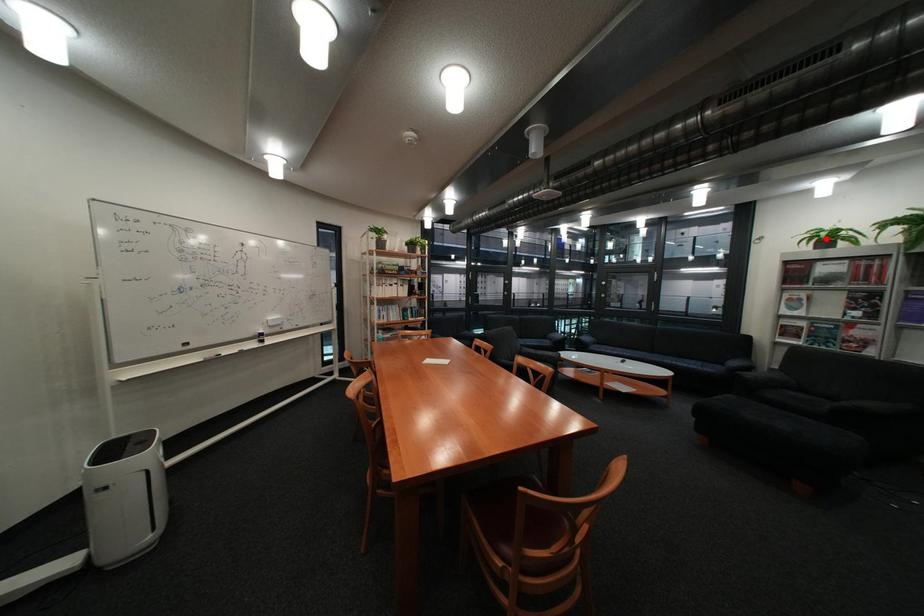
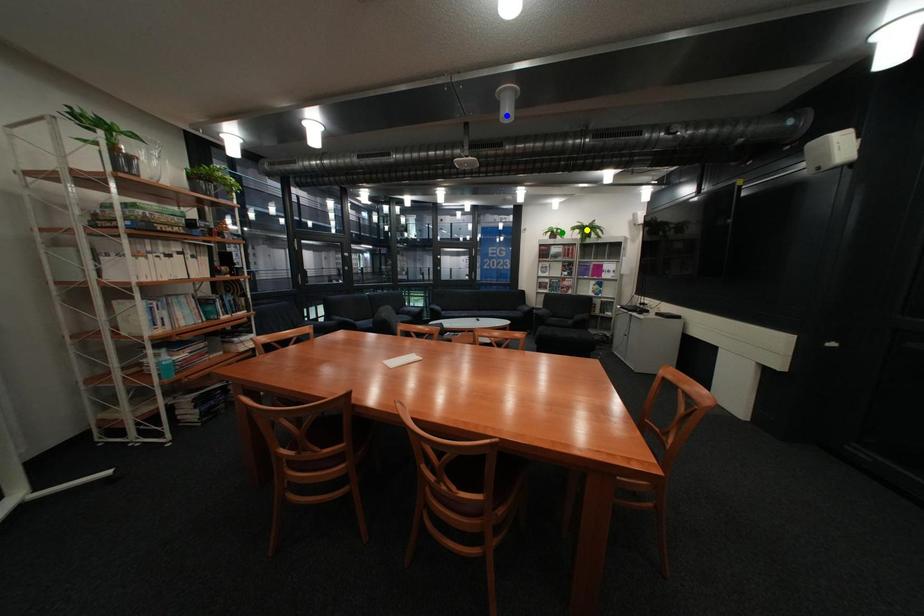
Question: I am providing you with two images of the same scene from different viewpoints. A red point is marked on the first image. You are given multiple points on the second image. In image 2, which mark is for the same physical point as the one in image 1?

Choices:
 (A) blue point
 (B) green point
 (C) yellow point

Answer: (B)